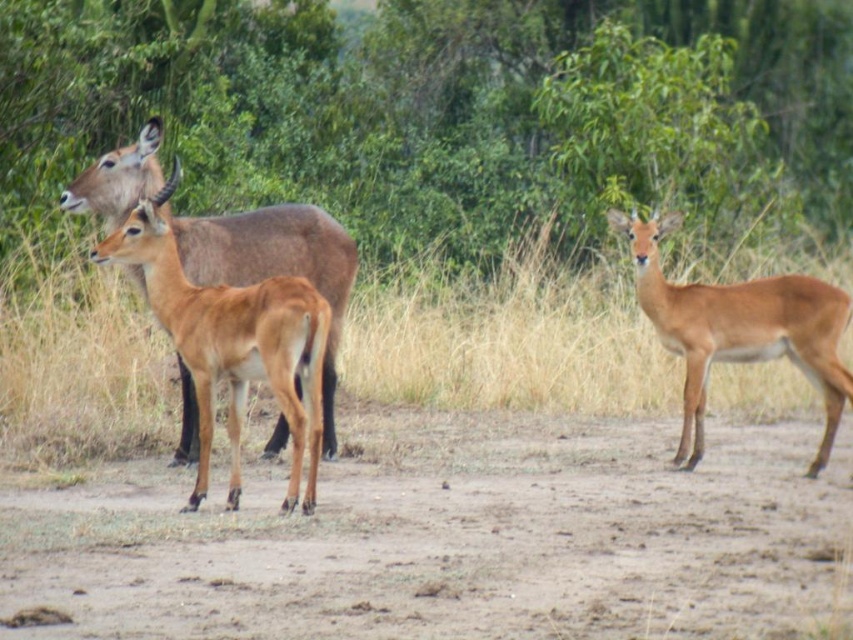
Between brown matte/deer at right and brown matte antelope at left, which one appears on the right side from the viewer's perspective?

From the viewer's perspective, brown matte/deer at right appears more on the right side.

Is point (845, 388) less distant than point (334, 304)?

That is True.

I want to click on brown matte/deer at right, so click(x=740, y=330).

This screenshot has width=853, height=640. In order to click on brown matte/deer at right in this screenshot , I will do `click(740, 330)`.

Is brown grass at center below brown matte antelope at left?

Yes, brown grass at center is below brown matte antelope at left.

The image size is (853, 640). Find the location of `brown grass at center`. brown grass at center is located at coordinates (509, 353).

Is point (430, 346) farther from camera compared to point (335, 312)?

Yes, it is behind point (335, 312).

Where is `brown grass at center`? brown grass at center is located at coordinates (509, 353).

This screenshot has width=853, height=640. What do you see at coordinates (509, 353) in the screenshot? I see `brown grass at center` at bounding box center [509, 353].

Between brown grass at center and brown matte/deer at right, which one appears on the left side from the viewer's perspective?

Positioned to the left is brown grass at center.

Find the location of `brown grass at center`. brown grass at center is located at coordinates (509, 353).

What are the coordinates of `brown grass at center` in the screenshot? It's located at (509, 353).